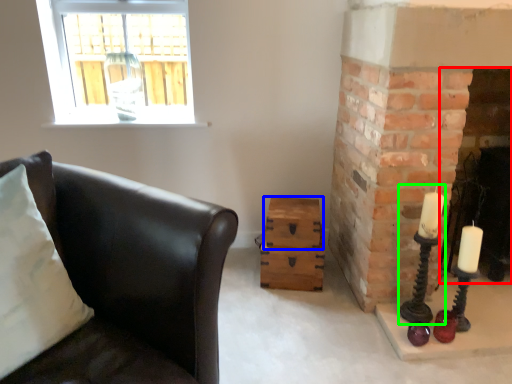
Question: Which is farther away from fireplace (highlighted by a red box)? drawer (highlighted by a blue box) or candle holder (highlighted by a green box)?

Choices:
 (A) drawer
 (B) candle holder

Answer: (A)